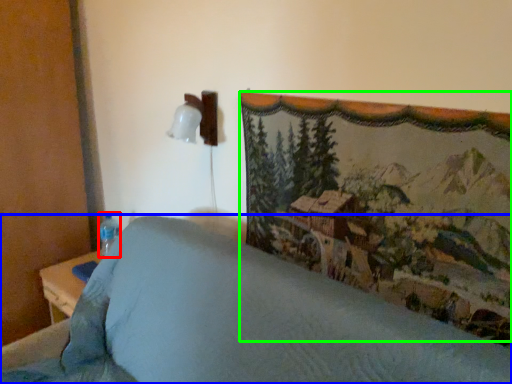
Question: Which object is the farthest from bottle (highlighted by a red box)? Choose among these: furniture (highlighted by a blue box) or mountain landscape (highlighted by a green box).

Choices:
 (A) furniture
 (B) mountain landscape

Answer: (B)